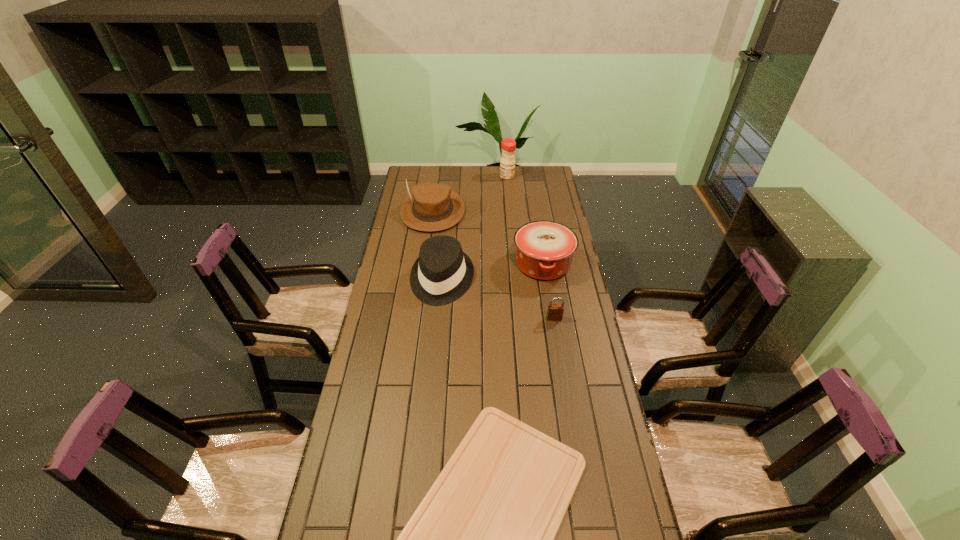
At what (x,y) coordinates should I click in order to perform the action: click on the farthest object. Please return your answer as a coordinate pair (x, y). The width and height of the screenshot is (960, 540). Looking at the image, I should click on (508, 145).

I want to click on the tallest object, so click(508, 145).

This screenshot has height=540, width=960. Find the location of `the farther fedora`. the farther fedora is located at coordinates (431, 207).

Locate an element on the screen. This screenshot has width=960, height=540. casserole is located at coordinates (545, 249).

I want to click on the nearer fedora, so click(443, 273).

Where is `padlock`? padlock is located at coordinates (555, 311).

Identify the location of the second shortest object. This screenshot has height=540, width=960. (555, 311).

This screenshot has width=960, height=540. I want to click on free space located on the front of the farthest object, so click(511, 213).

Find the location of a particular element. The width and height of the screenshot is (960, 540). vacant area situated 0.070m on the feather side of the farther fedora is located at coordinates (428, 244).

Where is `free space located on the left of the casserole`? The width and height of the screenshot is (960, 540). free space located on the left of the casserole is located at coordinates (460, 264).